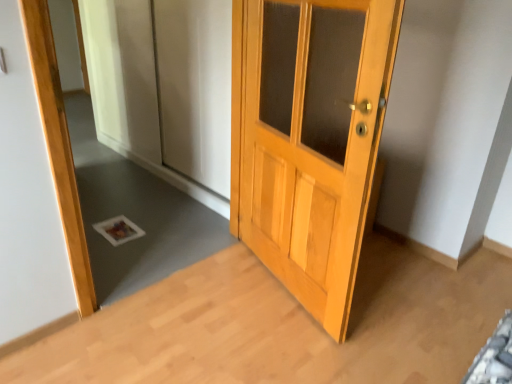
The image size is (512, 384). I want to click on vacant position to the left of light brown wooden door at center, so click(x=212, y=291).